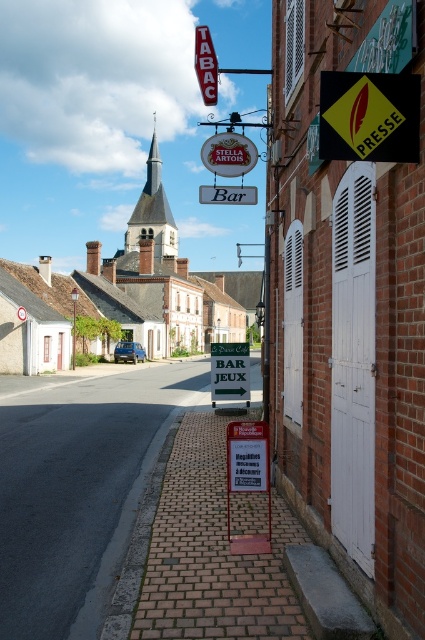
Is point (178, 266) farther from camera compared to point (232, 342)?

Yes, point (178, 266) is farther from viewer.

Can you confirm if matte white building at center is shorter than black plastic sign at center?

Incorrect, matte white building at center's height does not fall short of black plastic sign at center's.

Who is more forward, (204,294) or (220,348)?

Positioned in front is point (220,348).

Where is `matte white building at center`? matte white building at center is located at coordinates (127, 291).

Does matte white building at center have a larger size compared to red neon sign at upper center?

No.

Can you confirm if matte white building at center is shorter than red neon sign at upper center?

Correct, matte white building at center is not as tall as red neon sign at upper center.

Which is in front, point (141, 292) or point (197, 40)?

Point (197, 40)

In order to click on matte white building at center in this screenshot , I will do `click(127, 291)`.

Consider the image. Is matte white building at center smaller than yellowmaterial/texturesign at upper right?

No, matte white building at center is not smaller than yellowmaterial/texturesign at upper right.

At what (x,y) coordinates should I click in order to perform the action: click on matte white building at center. Please return your answer as a coordinate pair (x, y). This screenshot has width=425, height=640. Looking at the image, I should click on (127, 291).